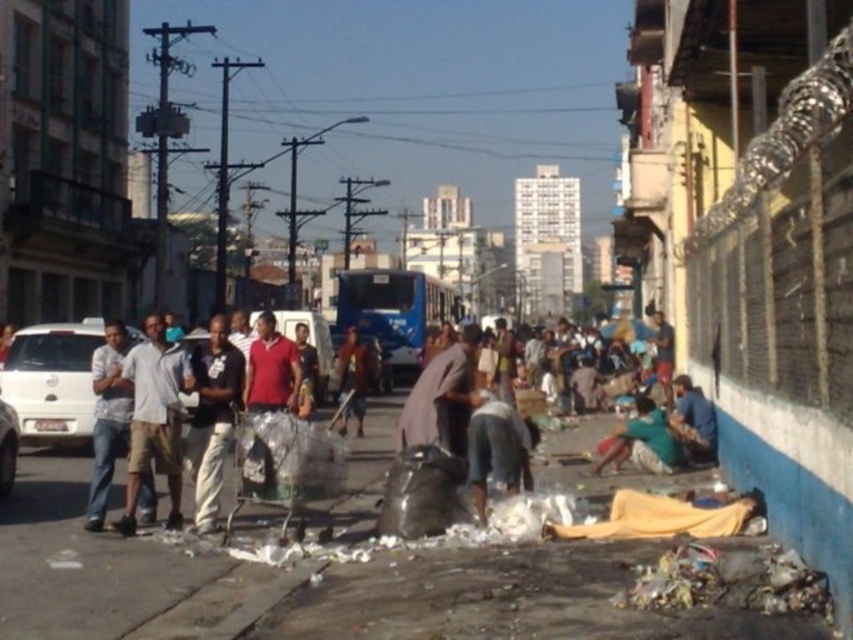
Question: Based on their relative distances, which object is nearer to the yellow fabric at lower right?

Choices:
 (A) brown fabric shirt at center
 (B) dark gray fabric at lower center

Answer: (B)

Question: Based on their relative distances, which object is farther from the white cotton shirt at left?

Choices:
 (A) dirty asphalt pavement at lower center
 (B) reddish-brown fabric pants at center
 (C) dark gray pants at center
 (D) brown fabric shirt at center

Answer: (B)

Question: Which point is farther to the camera?

Choices:
 (A) reddish-brown fabric pants at center
 (B) green fabric shirt at lower right

Answer: (A)

Question: In this image, where is white cotton shirt at left located relative to reddish-brown fabric pants at center?

Choices:
 (A) below
 (B) above

Answer: (B)

Question: Does brown fabric shirt at center appear over green fabric shirt at lower right?

Choices:
 (A) yes
 (B) no

Answer: (A)

Question: Is white cotton shirt at left to the left of green fabric shirt at lower right from the viewer's perspective?

Choices:
 (A) no
 (B) yes

Answer: (B)